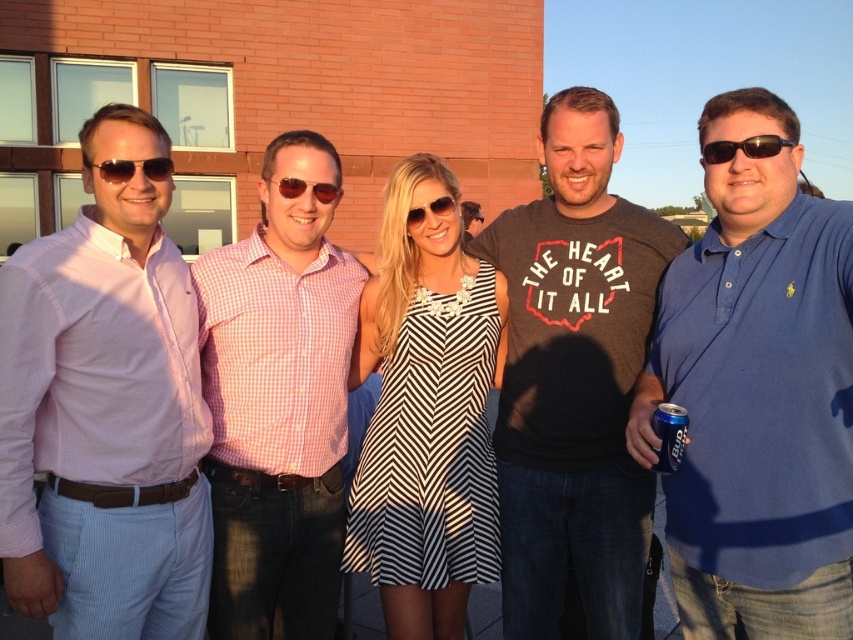
Between point (773, 147) and point (132, 168), which one is positioned behind?

Positioned behind is point (132, 168).

Is black plastic sunglasses at right positioned in front of matte black sunglasses at left?

Yes, it is.

Is point (758, 141) more distant than point (149, 160)?

No, it is not.

The height and width of the screenshot is (640, 853). In order to click on black plastic sunglasses at right in this screenshot , I will do `click(743, 147)`.

Between pink checkered shirt at left and brown reflective sunglasses at center, which one has more height?

With more height is pink checkered shirt at left.

Image resolution: width=853 pixels, height=640 pixels. I want to click on pink checkered shirt at left, so click(105, 412).

Identify the location of pink checkered shirt at left. The height and width of the screenshot is (640, 853). (105, 412).

Does point (582, 481) lie in front of point (102, 164)?

No, (582, 481) is further to viewer.

Is dark gray t-shirt at center wider than matte black sunglasses at left?

Correct, the width of dark gray t-shirt at center exceeds that of matte black sunglasses at left.

Between point (546, 609) and point (171, 173), which one is positioned behind?

The point (171, 173) is more distant.

The image size is (853, 640). I want to click on dark gray t-shirt at center, so click(x=573, y=380).